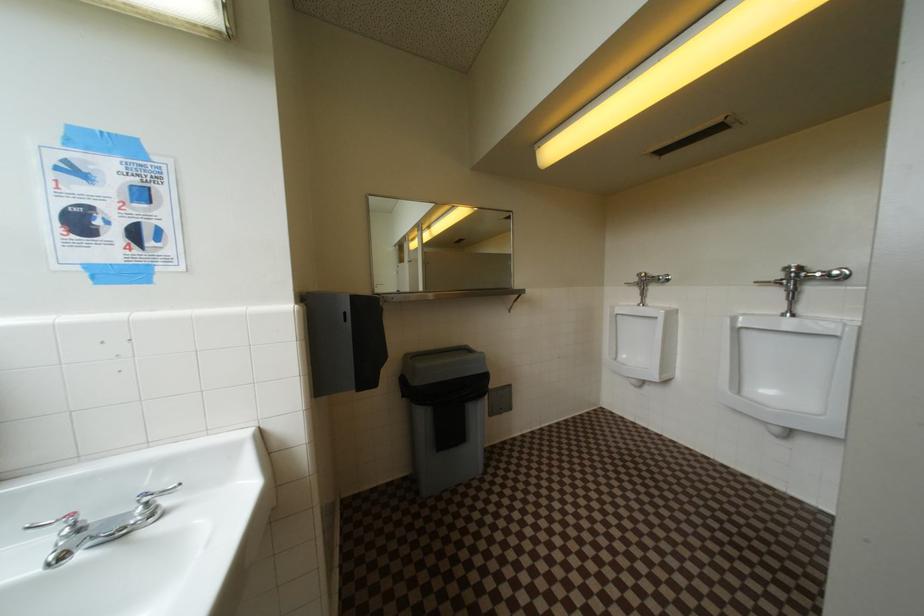
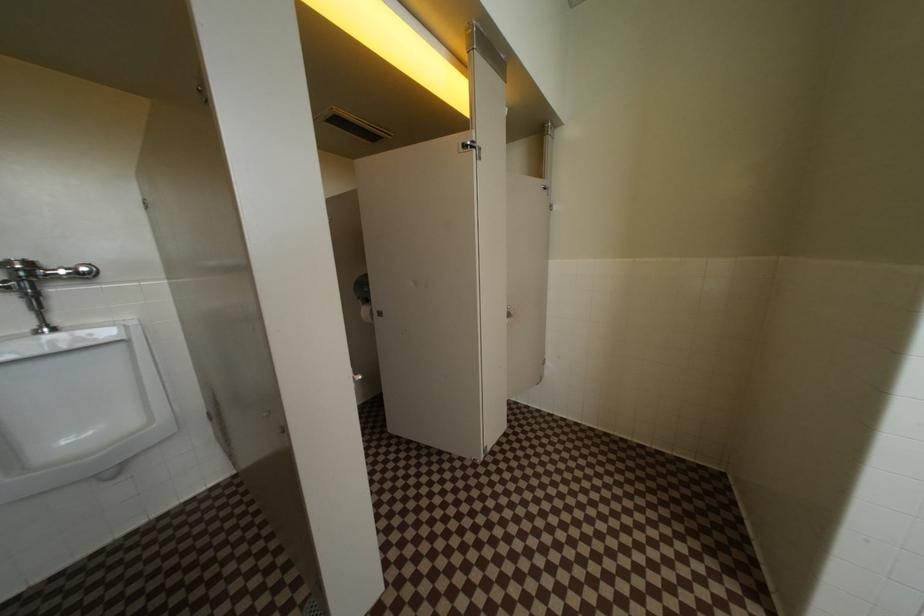
Question: The first image is from the beginning of the video and the second image is from the end. How did the camera likely rotate when shooting the video?

Choices:
 (A) Left
 (B) Right
 (C) Up
 (D) Down

Answer: (B)